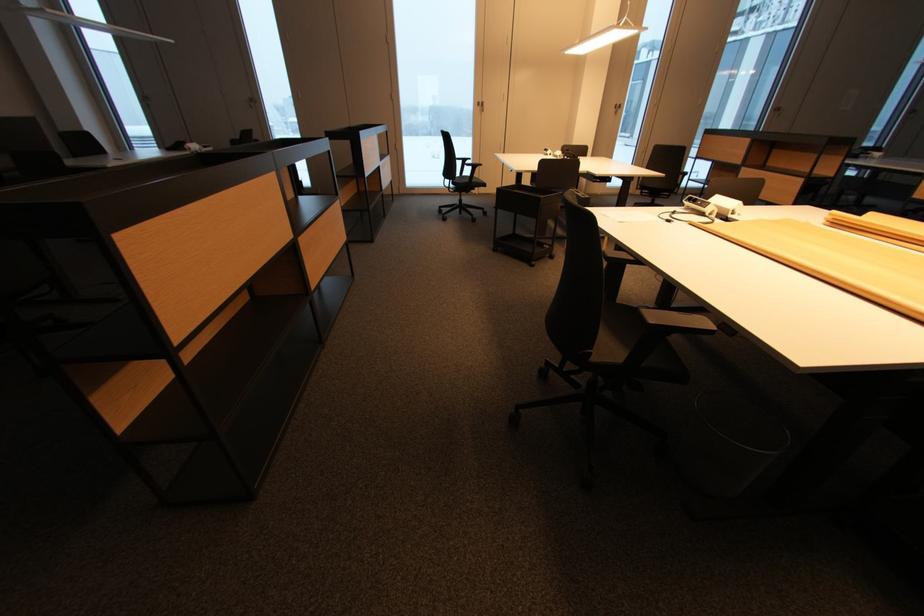
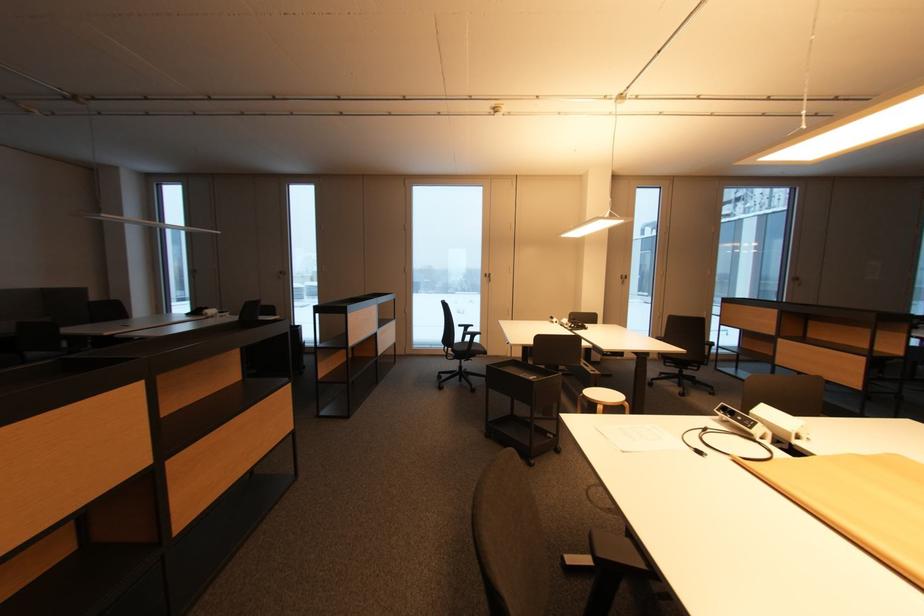
In a continuous first-person perspective shot, in which direction is the camera moving?

The cameraman walked toward right, forward.